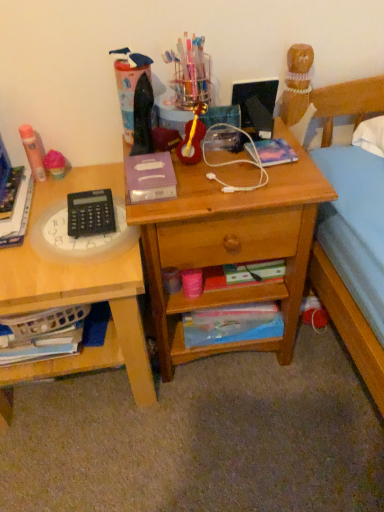
Question: From a real-world perspective, relative to white matte earphones at center, is wooden desk at center vertically above or below?

Choices:
 (A) above
 (B) below

Answer: (B)

Question: Considering the relative positions of wooden desk at center and white matte earphones at center in the image provided, is wooden desk at center to the left or to the right of white matte earphones at center?

Choices:
 (A) left
 (B) right

Answer: (A)

Question: Estimate the real-world distances between objects in this image. Which object is closer to the shiny black laptop at upper center?

Choices:
 (A) matte orange glue stick at left, which is the 3th stationery from right to left
 (B) pink fluffy ball at left, which is the second stationery from left to right
 (C) hardcover book at left
 (D) multicolored fabric book at center, which ranks as the 2th paperback book in front-to-back order
 (E) wooden desk at center

Answer: (D)

Question: Estimate the real-world distances between objects in this image. Which object is farther from the hardcover book at left?

Choices:
 (A) white matte earphones at center
 (B) wooden desk at left
 (C) black plastic calculator at left
 (D) matte orange glue stick at left, which is the 3th stationery from right to left
 (E) wooden desk at center

Answer: (E)